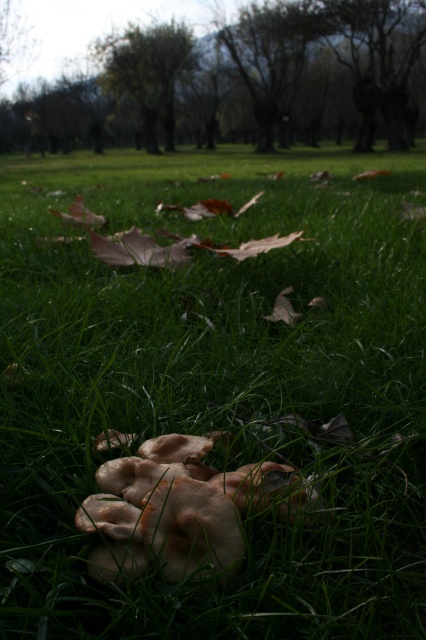
How distant is brown textured tree at center from green leafy tree at upper center?

brown textured tree at center and green leafy tree at upper center are 4.27 meters apart from each other.

Can you confirm if brown textured tree at center is smaller than green leafy tree at upper center?

No.

Does point (19, 102) lie behind point (112, 88)?

No, it is not.

The height and width of the screenshot is (640, 426). I want to click on brown textured tree at center, so click(239, 83).

Does brown textured tree at center appear over light brown soft fungi at center?

Yes.

Is brown textured tree at center below light brown soft fungi at center?

No.

Is point (365, 97) more distant than point (104, 554)?

Yes, it is behind point (104, 554).

This screenshot has height=640, width=426. In order to click on brown textured tree at center in this screenshot , I will do `click(239, 83)`.

Does light brown soft fungi at center come in front of green leafy tree at upper center?

Yes, it is.

Is light brown soft fungi at center bigger than green leafy tree at upper center?

No, light brown soft fungi at center is not bigger than green leafy tree at upper center.

Which is behind, point (109, 467) or point (164, 106)?

The point (164, 106) is behind.

Identify the location of light brown soft fungi at center. This screenshot has width=426, height=640. (181, 509).